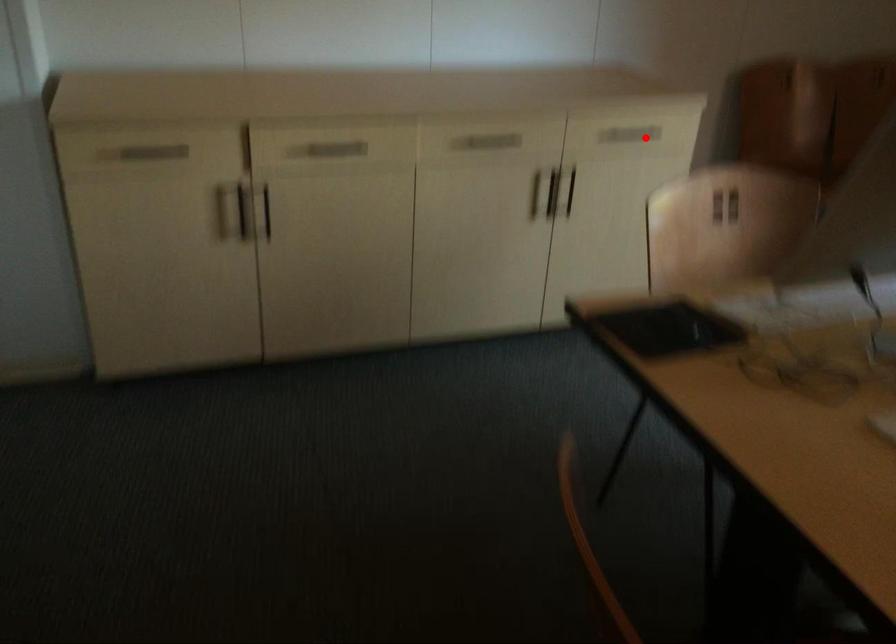
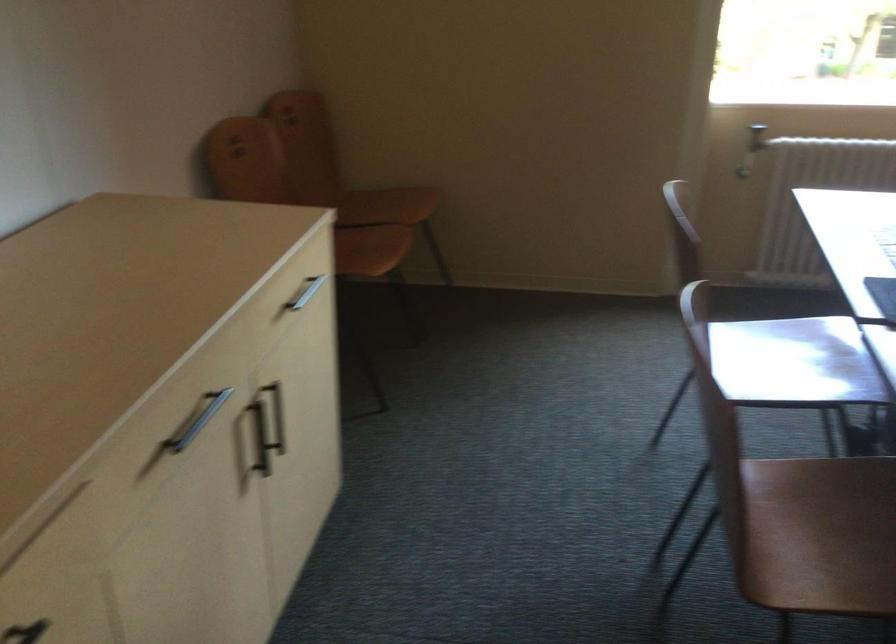
Question: A red point is marked in image1. In image2, is the corresponding 3D point closer to the camera or farther? Reply with the corresponding letter.

Choices:
 (A) The corresponding 3D point is closer.
 (B) The corresponding 3D point is farther.

Answer: (A)